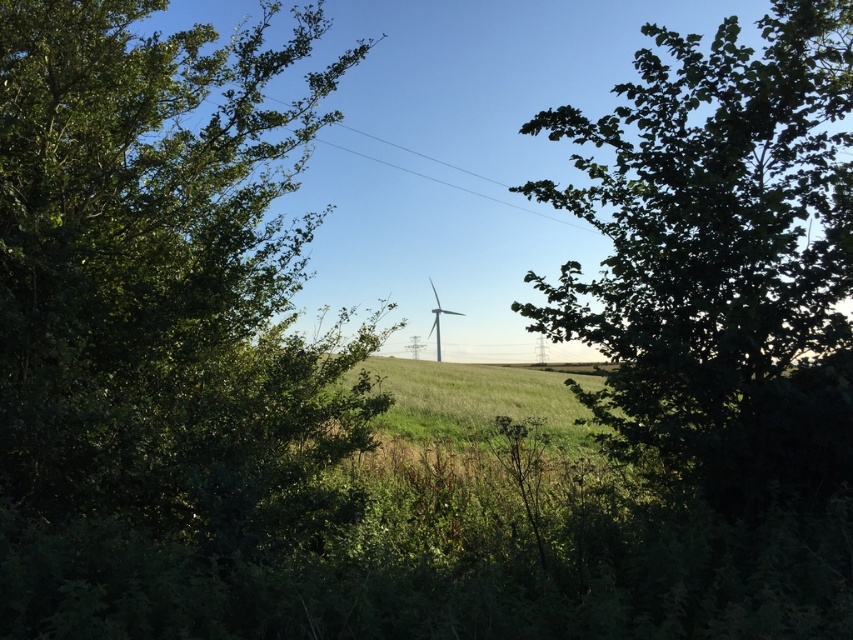
Is point (190, 627) in front of point (438, 301)?

Yes, point (190, 627) is in front of point (438, 301).

I want to click on green leafy tree at left, so click(x=155, y=321).

Is point (132, 244) farther from camera compared to point (519, 308)?

No, it is not.

Consider the image. Is green leafy tree at left below green leafy tree at center?

Correct, green leafy tree at left is located below green leafy tree at center.

Is point (22, 317) closer to viewer compared to point (688, 177)?

Yes, it is.

This screenshot has width=853, height=640. Identify the location of green leafy tree at left. (155, 321).

Is green leafy tree at center to the right of white matte wind turbine at center from the viewer's perspective?

Yes, green leafy tree at center is to the right of white matte wind turbine at center.

Which is below, green leafy tree at center or white matte wind turbine at center?

white matte wind turbine at center

Find the location of a particular element. This screenshot has width=853, height=640. green leafy tree at center is located at coordinates (721, 257).

The image size is (853, 640). I want to click on green leafy tree at center, so click(721, 257).